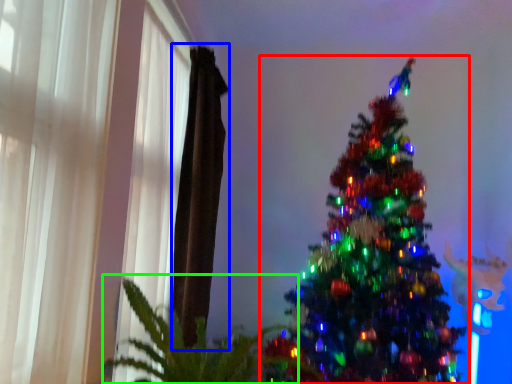
Question: Considering the real-world distances, which object is closest to christmas tree (highlighted by a red box)? curtain (highlighted by a blue box) or plant (highlighted by a green box).

Choices:
 (A) curtain
 (B) plant

Answer: (B)